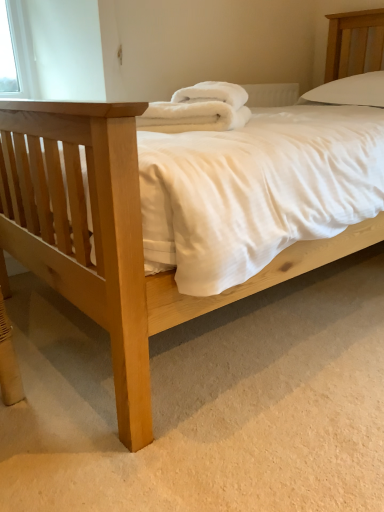
What do you see at coordinates (198, 109) in the screenshot? Image resolution: width=384 pixels, height=512 pixels. I see `white fluffy towels at center` at bounding box center [198, 109].

You are a GUI agent. You are given a task and a screenshot of the screen. Output one action in this format:
    pyautogui.click(x=<x>, y=<y>)
    Task: Click on the white fluffy towels at center
    
    Given the screenshot: What is the action you would take?
    pyautogui.click(x=198, y=109)

I want to click on white fluffy towels at center, so click(198, 109).